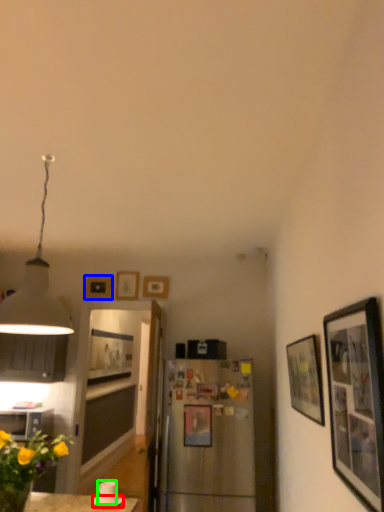
Question: Which object is positioned closest to saucer (highlighted by a red box)? Select from picture frame (highlighted by a blue box) and coffee cup (highlighted by a green box).

Choices:
 (A) picture frame
 (B) coffee cup

Answer: (B)